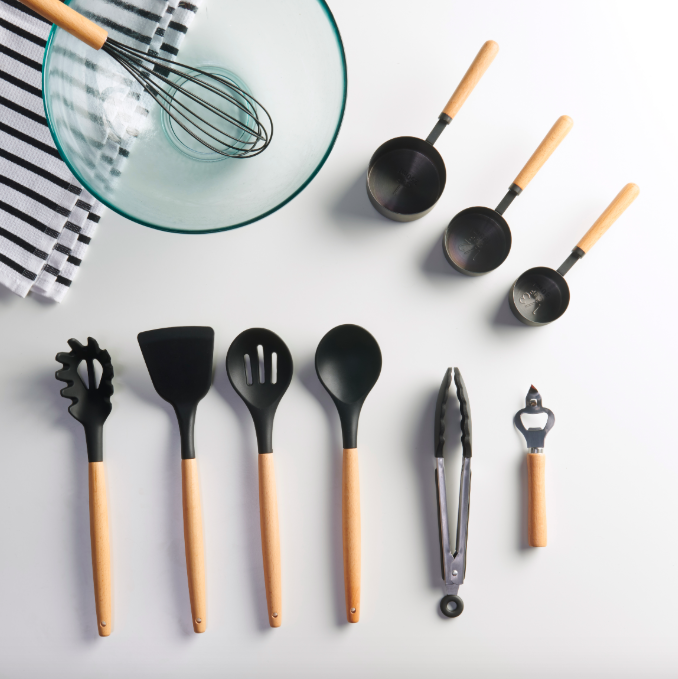
This screenshot has width=678, height=679. I want to click on handle, so click(x=96, y=515).